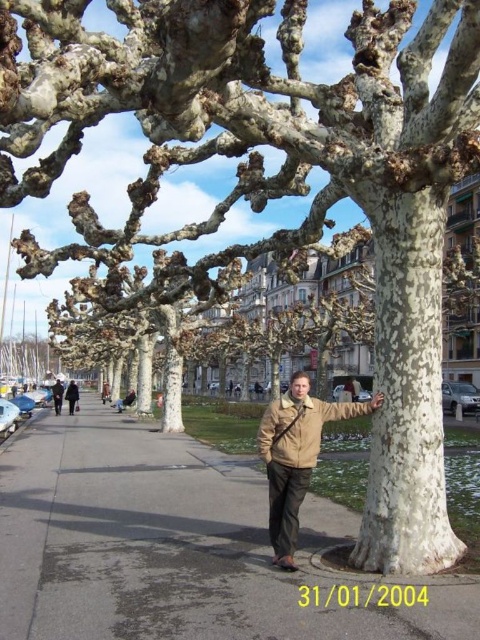
You are a photographer trying to capture a clear shot of the white textured tree trunk at center and the khaki cotton jacket at center. Since you want both subjects to be in focus, which one should you adjust your camera focus on first?

The white textured tree trunk at center is in front of the khaki cotton jacket at center, so you should focus on the khaki cotton jacket at center first to ensure both are in focus.

You are a delivery person trying to place a package on the gray asphalt sidewalk at center. The beige leather jacket at center is in the way. Can the package be placed on the sidewalk without moving the jacket?

The gray asphalt sidewalk at center has a lesser height compared to beige leather jacket at center, meaning the jacket is taller than the sidewalk. Since the jacket is on the sidewalk, it would block the area, so you need to move the jacket to place the package there.